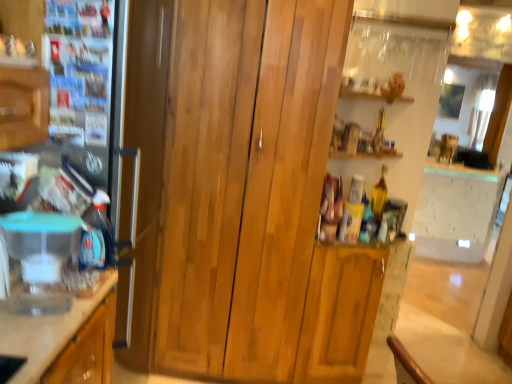
Question: In the image, is clear plastic container at left on the left side or the right side of transparent plastic container at left?

Choices:
 (A) right
 (B) left

Answer: (B)

Question: Considering the positions of clear plastic container at left and transparent plastic container at left in the image, is clear plastic container at left taller or shorter than transparent plastic container at left?

Choices:
 (A) short
 (B) tall

Answer: (B)

Question: Estimate the real-world distances between objects in this image. Which object is closer to the transparent plastic container at left?

Choices:
 (A) satin silver fridge at left
 (B) clear plastic container at left
 (C) wooden cabinet at center

Answer: (B)

Question: Estimate the real-world distances between objects in this image. Which object is farther from the satin silver fridge at left?

Choices:
 (A) clear plastic container at left
 (B) transparent plastic container at left
 (C) wooden cabinet at center

Answer: (A)